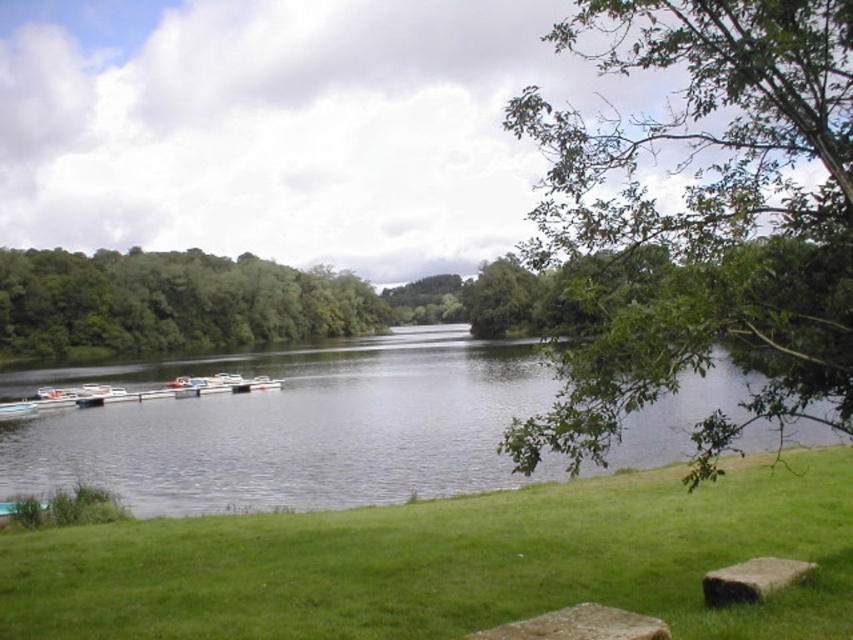
Looking at this image, you are standing at the wooden jetty and notice two points marked in the image. One is labeled as point (228, 566) and the other as point (573, 353). Which point is farther away from your current position?

Point (228, 566) is farther away from your current position because it is located behind point (573, 353).

You are planning to take a photo of the white plastic boats at lower left and the green leafy trees at left. Which object should you focus on first if you want to capture both in a single frame without moving the camera?

The green leafy trees at left are wider than the white plastic boats at lower left, so you should focus on the green leafy trees at left first to ensure they fit within the frame.